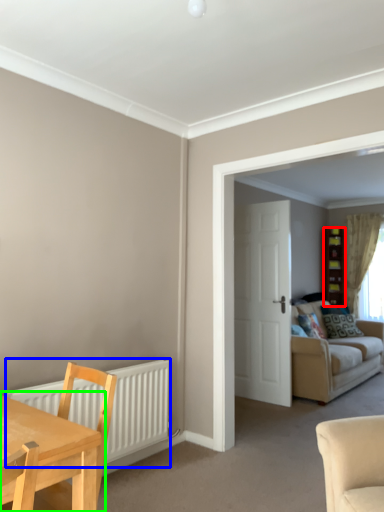
Question: Estimate the real-world distances between objects in this image. Which object is farther from cabinetry (highlighted by a red box), radiator (highlighted by a blue box) or table (highlighted by a green box)?

Choices:
 (A) radiator
 (B) table

Answer: (B)